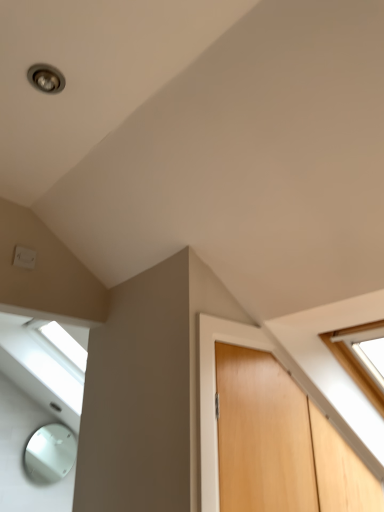
Question: From the image's perspective, is light brown wood door at center on white plastic electric outlet at upper left?

Choices:
 (A) no
 (B) yes

Answer: (A)

Question: From the image's perspective, is light brown wood door at center under white plastic electric outlet at upper left?

Choices:
 (A) yes
 (B) no

Answer: (A)

Question: Considering the relative positions of light brown wood door at center and white plastic electric outlet at upper left in the image provided, is light brown wood door at center to the left of white plastic electric outlet at upper left from the viewer's perspective?

Choices:
 (A) no
 (B) yes

Answer: (A)

Question: Is the position of light brown wood door at center more distant than that of white plastic electric outlet at upper left?

Choices:
 (A) no
 (B) yes

Answer: (A)

Question: Can you confirm if light brown wood door at center is taller than white plastic electric outlet at upper left?

Choices:
 (A) yes
 (B) no

Answer: (A)

Question: From a real-world perspective, is light brown wood door at center under white plastic electric outlet at upper left?

Choices:
 (A) yes
 (B) no

Answer: (A)

Question: Can you confirm if white plastic electric outlet at upper left is wider than light brown wood door at center?

Choices:
 (A) yes
 (B) no

Answer: (B)

Question: Can you confirm if white plastic electric outlet at upper left is bigger than light brown wood door at center?

Choices:
 (A) yes
 (B) no

Answer: (B)

Question: Is white plastic electric outlet at upper left shorter than light brown wood door at center?

Choices:
 (A) no
 (B) yes

Answer: (B)

Question: Is white plastic electric outlet at upper left placed right next to light brown wood door at center?

Choices:
 (A) no
 (B) yes

Answer: (A)

Question: Is white plastic electric outlet at upper left far from light brown wood door at center?

Choices:
 (A) no
 (B) yes

Answer: (B)

Question: Is white plastic electric outlet at upper left facing away from light brown wood door at center?

Choices:
 (A) yes
 (B) no

Answer: (B)

Question: Which is correct: white plastic electric outlet at upper left is inside light brown wood door at center, or outside of it?

Choices:
 (A) outside
 (B) inside

Answer: (A)